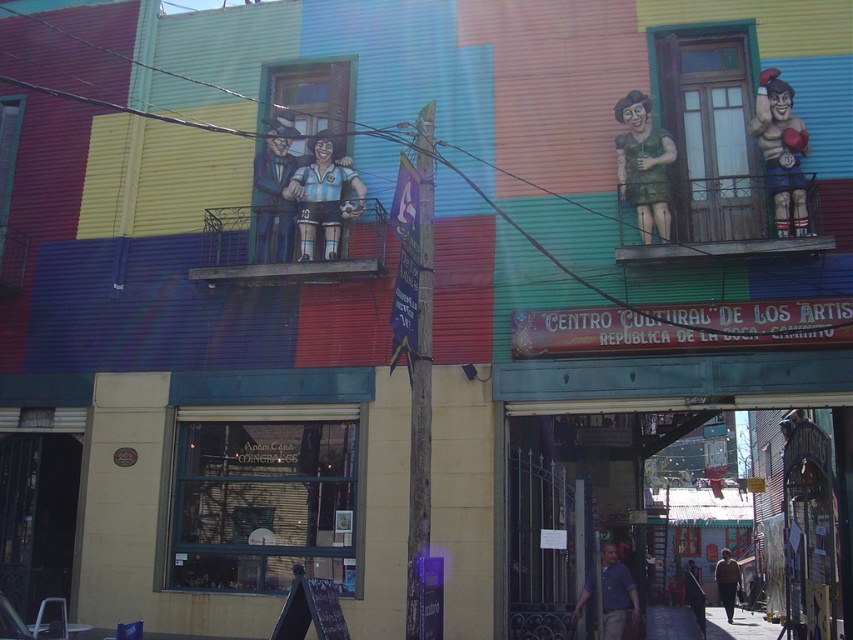
You are an artist planning to paint the building facade. You need to decide where to place a new decorative element. Considering the space taken by the green matte statue at upper right and the dark blue suit at lower right, which area has more room for additional decorations?

The dark blue suit at lower right has more space available for additional decorations since it occupies less area than the green matte statue at upper right.

You are an architect analyzing the building facade. You need to determine if the green matte statue at upper right can fit into a space originally designed for the dark blue suit at lower right. Based on their widths, will it fit?

The green matte statue at upper right has a lesser width compared to the dark blue suit at lower right, so it should fit into the space designed for the dark blue suit at lower right.

You are standing in front of the building and want to take a photo of both the matte black soccer player at center and the dark blue suit at lower right. Which object will appear larger in your photo?

The matte black soccer player at center will appear larger in the photo because it is closer to the viewer than the dark blue suit at lower right.